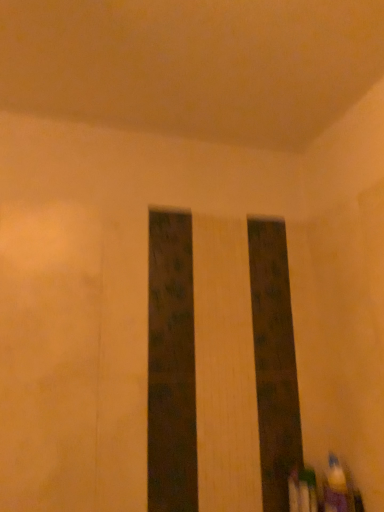
What do you see at coordinates (336, 487) in the screenshot?
I see `translucent plastic bottle at lower right` at bounding box center [336, 487].

At what (x,y) coordinates should I click in order to perform the action: click on translucent plastic bottle at lower right. Please return your answer as a coordinate pair (x, y). Looking at the image, I should click on (336, 487).

Image resolution: width=384 pixels, height=512 pixels. I want to click on translucent plastic bottle at lower right, so click(x=336, y=487).